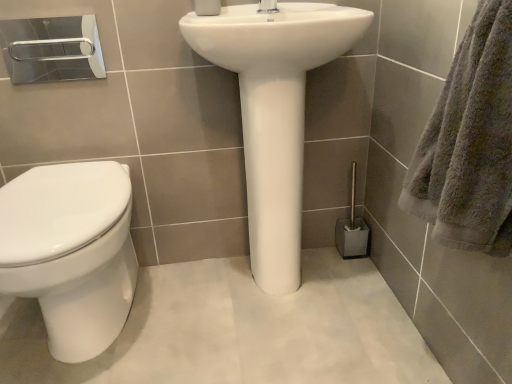
What do you see at coordinates (51, 49) in the screenshot?
I see `silver metallic towel bar at upper left` at bounding box center [51, 49].

Where is `silver metallic towel bar at upper left`? silver metallic towel bar at upper left is located at coordinates (51, 49).

The height and width of the screenshot is (384, 512). Describe the element at coordinates (207, 7) in the screenshot. I see `white matte toilet paper at upper center` at that location.

The width and height of the screenshot is (512, 384). What do you see at coordinates (268, 6) in the screenshot?
I see `white glossy tap at upper center` at bounding box center [268, 6].

Measure the distance between point [345,236] and camera.

The depth of point [345,236] is 1.44 meters.

Describe the element at coordinates (274, 112) in the screenshot. Image resolution: width=512 pixels, height=384 pixels. I see `white glossy sink at center` at that location.

This screenshot has width=512, height=384. I want to click on silver metallic towel bar at upper left, so click(51, 49).

What's the angular difference between gray fluffy towel at right and white glossy toilet at left's facing directions?

The angular difference between gray fluffy towel at right and white glossy toilet at left is 88.5 degrees.

In terms of height, does gray fluffy towel at right look taller or shorter compared to white glossy toilet at left?

In the image, gray fluffy towel at right appears to be shorter than white glossy toilet at left.

Does gray fluffy towel at right have a greater width compared to white glossy toilet at left?

No.

Considering the relative positions of gray fluffy towel at right and white glossy toilet at left in the image provided, is gray fluffy towel at right behind white glossy toilet at left?

No, the depth of gray fluffy towel at right is less than that of white glossy toilet at left.

Considering the sizes of objects white glossy tap at upper center and metallic silver toilet brush at lower right in the image provided, who is wider, white glossy tap at upper center or metallic silver toilet brush at lower right?

white glossy tap at upper center.

Where is `tap on the left of metallic silver toilet brush at lower right`? The image size is (512, 384). tap on the left of metallic silver toilet brush at lower right is located at coordinates (268, 6).

Is white glossy tap at upper center facing towards metallic silver toilet brush at lower right?

No.

How far apart are white glossy tap at upper center and metallic silver toilet brush at lower right?

They are 28.55 inches apart.

Is the position of metallic silver toilet brush at lower right more distant than that of white glossy tap at upper center?

That is True.

Is metallic silver toilet brush at lower right not close to white glossy tap at upper center?

metallic silver toilet brush at lower right is near white glossy tap at upper center, not far away.

Would you say metallic silver toilet brush at lower right is inside or outside white glossy tap at upper center?

metallic silver toilet brush at lower right is located beyond the bounds of white glossy tap at upper center.

Considering the positions of objects metallic silver toilet brush at lower right and silver metallic towel bar at upper left in the image provided, who is in front, metallic silver toilet brush at lower right or silver metallic towel bar at upper left?

silver metallic towel bar at upper left is closer to the camera.

Does metallic silver toilet brush at lower right appear on the right side of silver metallic towel bar at upper left?

Yes.

Which is in front, point (367, 253) or point (55, 58)?

The point (367, 253) is more forward.

Is metallic silver toilet brush at lower right positioned beyond the bounds of silver metallic towel bar at upper left?

Yes, metallic silver toilet brush at lower right is not within silver metallic towel bar at upper left.

Who is shorter, white glossy tap at upper center or white glossy toilet at left?

With less height is white glossy tap at upper center.

The height and width of the screenshot is (384, 512). What are the coordinates of `bidet that appears below the white glossy tap at upper center (from a real-world perspective)` in the screenshot? It's located at (71, 252).

Which is behind, white glossy tap at upper center or white glossy toilet at left?

white glossy tap at upper center is further away from the camera.

Is white glossy tap at upper center oriented towards white glossy toilet at left?

No, white glossy tap at upper center does not turn towards white glossy toilet at left.

Is white matte toilet paper at upper center looking in the opposite direction of metallic silver toilet brush at lower right?

white matte toilet paper at upper center does not have its back to metallic silver toilet brush at lower right.

From a real-world perspective, which object stands above the other?

white matte toilet paper at upper center, from a real-world perspective.

How different are the orientations of white matte toilet paper at upper center and metallic silver toilet brush at lower right in degrees?

There is a 0.00141-degree angle between the facing directions of white matte toilet paper at upper center and metallic silver toilet brush at lower right.

From the image's perspective, which one is positioned higher, gray fluffy towel at right or metallic silver toilet brush at lower right?

gray fluffy towel at right appears higher in the image.

Is gray fluffy towel at right facing away from metallic silver toilet brush at lower right?

gray fluffy towel at right does not have its back to metallic silver toilet brush at lower right.

Considering the sizes of gray fluffy towel at right and metallic silver toilet brush at lower right in the image, is gray fluffy towel at right taller or shorter than metallic silver toilet brush at lower right?

In the image, gray fluffy towel at right appears to be taller than metallic silver toilet brush at lower right.

Identify the location of bath towel lying above the metallic silver toilet brush at lower right (from the image's perspective). The width and height of the screenshot is (512, 384). (470, 143).

Locate an element on the screen. bidet behind the gray fluffy towel at right is located at coordinates (71, 252).

I want to click on brush that appears below the white glossy tap at upper center (from the image's perspective), so pyautogui.click(x=352, y=229).

When comparing their distances from metallic silver toilet brush at lower right, does white matte toilet paper at upper center or white glossy tap at upper center seem closer?

white glossy tap at upper center lies closer to metallic silver toilet brush at lower right than the other object.

Which object lies further to the anchor point white glossy tap at upper center, silver metallic towel bar at upper left or white glossy sink at center?

Based on the image, silver metallic towel bar at upper left appears to be further to white glossy tap at upper center.

From the image, which object appears to be nearer to silver metallic towel bar at upper left, white glossy tap at upper center or white matte toilet paper at upper center?

Among the two, white matte toilet paper at upper center is located nearer to silver metallic towel bar at upper left.

Which object lies nearer to the anchor point white matte toilet paper at upper center, white glossy tap at upper center or metallic silver toilet brush at lower right?

white glossy tap at upper center lies closer to white matte toilet paper at upper center than the other object.

Looking at the image, which one is located closer to silver metallic towel bar at upper left, white matte toilet paper at upper center or gray fluffy towel at right?

white matte toilet paper at upper center is closer to silver metallic towel bar at upper left.

Based on their spatial positions, is metallic silver toilet brush at lower right or white matte toilet paper at upper center closer to gray fluffy towel at right?

Result: The object closer to gray fluffy towel at right is metallic silver toilet brush at lower right.

Consider the image. From the image, which object appears to be farther from white glossy toilet at left, silver metallic towel bar at upper left or white glossy sink at center?

Based on the image, silver metallic towel bar at upper left appears to be further to white glossy toilet at left.

Which object lies further to the anchor point white glossy sink at center, silver metallic towel bar at upper left or white glossy toilet at left?

Among the two, silver metallic towel bar at upper left is located further to white glossy sink at center.

The height and width of the screenshot is (384, 512). I want to click on sink that lies between white glossy tap at upper center and white glossy toilet at left from top to bottom, so click(274, 112).

Where is `sink between white glossy toilet at left and metallic silver toilet brush at lower right`? The height and width of the screenshot is (384, 512). sink between white glossy toilet at left and metallic silver toilet brush at lower right is located at coordinates (274, 112).

This screenshot has width=512, height=384. I want to click on towel bar between white matte toilet paper at upper center and white glossy toilet at left from top to bottom, so click(x=51, y=49).

You are a GUI agent. You are given a task and a screenshot of the screen. Output one action in this format:
    pyautogui.click(x=<x>, y=<y>)
    Task: Click on the toilet paper located between gray fluffy towel at right and metallic silver toilet brush at lower right in the depth direction
    The image size is (512, 384).
    Given the screenshot: What is the action you would take?
    pyautogui.click(x=207, y=7)